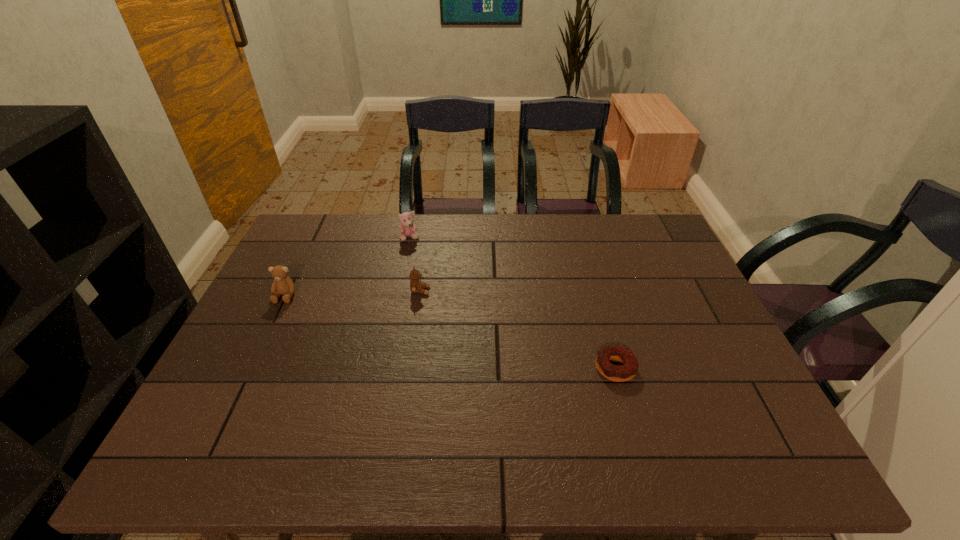
This screenshot has height=540, width=960. What are the coordinates of `blank area located on the left of the doughnut` in the screenshot? It's located at (545, 368).

Locate an element on the screen. This screenshot has width=960, height=540. object present at the far edge is located at coordinates (407, 228).

Where is `object that is at the left edge`? The height and width of the screenshot is (540, 960). object that is at the left edge is located at coordinates (282, 285).

Where is `vacant space at the far edge of the desktop`? vacant space at the far edge of the desktop is located at coordinates (438, 217).

Identify the location of free space at the near edge of the desktop. This screenshot has height=540, width=960. pos(294,438).

Where is `free location at the left edge of the desktop`? The width and height of the screenshot is (960, 540). free location at the left edge of the desktop is located at coordinates (225, 399).

Identify the location of free space at the right edge of the desktop. (662, 279).

In the image, there is a desktop. At what (x,y) coordinates should I click in order to perform the action: click on vacant space at the far left corner. Please return your answer as a coordinate pair (x, y). Image resolution: width=960 pixels, height=540 pixels. Looking at the image, I should click on (342, 230).

Find the location of a particular element. The width and height of the screenshot is (960, 540). vacant space at the far right corner of the desktop is located at coordinates (631, 256).

This screenshot has width=960, height=540. Find the location of `vacant space that is in between the second object from left to right and the shortest teddy bear`. vacant space that is in between the second object from left to right and the shortest teddy bear is located at coordinates (415, 264).